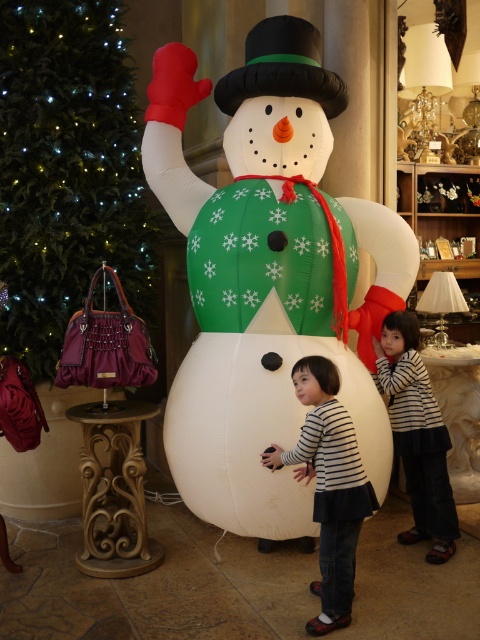
Is the position of inflatable white snowman at center less distant than that of striped fabric shirt at center?

That is True.

Consider the image. Who is more forward, (169, 140) or (444, 440)?

Point (444, 440) is more forward.

Who is more distant from viewer, [167,161] or [431,416]?

The point [167,161] is behind.

Image resolution: width=480 pixels, height=640 pixels. I want to click on inflatable white snowman at center, so point(267,275).

Does striped cotton shirt at center come in front of striped fabric shirt at center?

Yes, it is in front of striped fabric shirt at center.

Who is taller, striped cotton shirt at center or striped fabric shirt at center?

striped fabric shirt at center

Image resolution: width=480 pixels, height=640 pixels. Find the location of `striped cotton shirt at center`. striped cotton shirt at center is located at coordinates click(328, 486).

Describe the element at coordinates (267, 275) in the screenshot. This screenshot has width=480, height=640. I see `inflatable white snowman at center` at that location.

The height and width of the screenshot is (640, 480). What do you see at coordinates (267, 275) in the screenshot? I see `inflatable white snowman at center` at bounding box center [267, 275].

The width and height of the screenshot is (480, 640). In order to click on inflatable white snowman at center in this screenshot , I will do `click(267, 275)`.